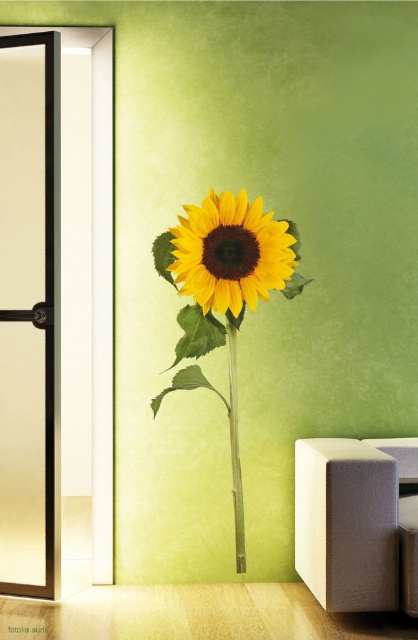
Question: Does yellow matte sunflower at center appear on the left side of green bamboo stem at center?

Choices:
 (A) yes
 (B) no

Answer: (A)

Question: Can you confirm if yellow matte sunflower at center is positioned to the left of green bamboo stem at center?

Choices:
 (A) yes
 (B) no

Answer: (A)

Question: Which object is farther from the camera taking this photo?

Choices:
 (A) green bamboo stem at center
 (B) yellow matte sunflower at center

Answer: (A)

Question: Can you confirm if yellow matte sunflower at center is wider than green bamboo stem at center?

Choices:
 (A) no
 (B) yes

Answer: (B)